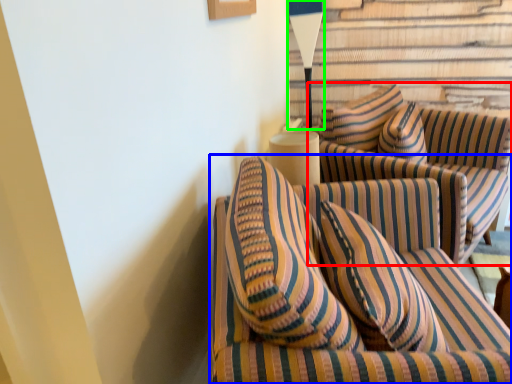
Question: Estimate the real-world distances between objects in this image. Which object is closer to studio couch (highlighted by a red box), studio couch (highlighted by a blue box) or table lamp (highlighted by a green box)?

Choices:
 (A) studio couch
 (B) table lamp

Answer: (A)